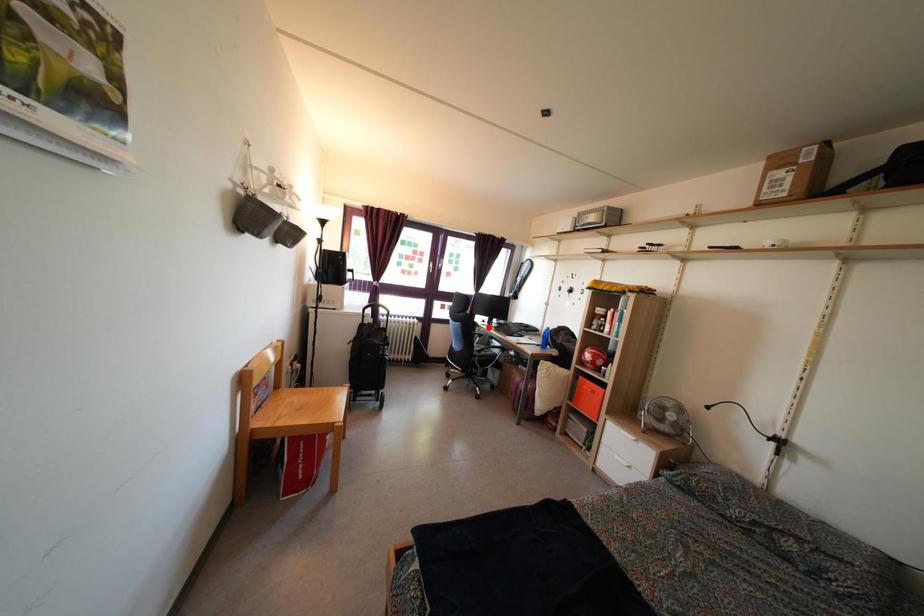
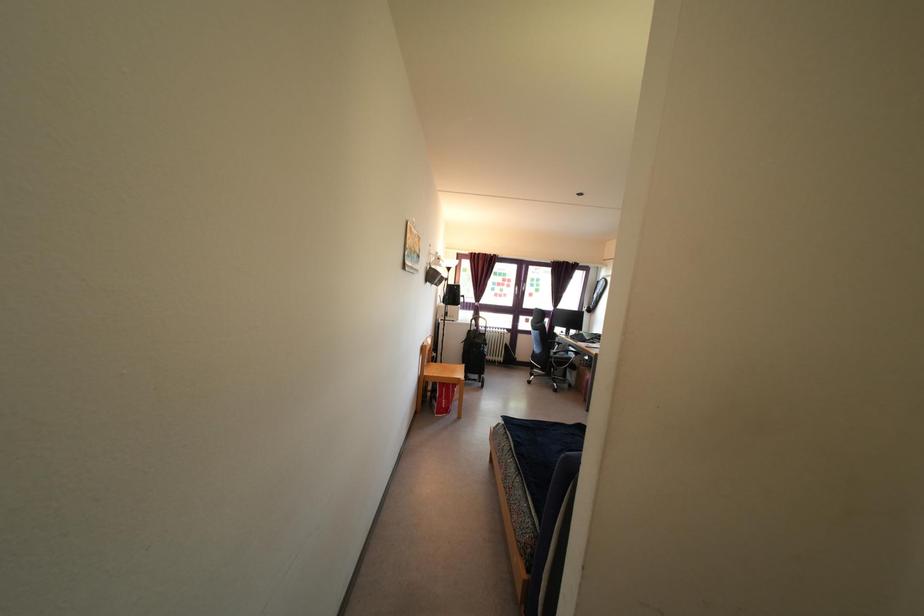
Question: I am providing you with two images of the same scene from different viewpoints. Image1 has a red point marked. In image2, the corresponding 3D location appears at what relative position? Reply with the corresponding letter.

Choices:
 (A) Closer
 (B) Farther

Answer: (B)